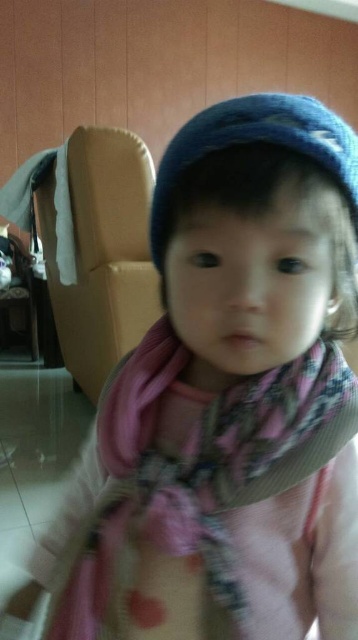
Question: Does pink plaid scarf at center have a lesser width compared to beige fabric armchair at left?

Choices:
 (A) yes
 (B) no

Answer: (A)

Question: Which is nearer to the beige fabric armchair at left?

Choices:
 (A) blue knitted hat at center
 (B) pink plaid scarf at center

Answer: (A)

Question: Does pink plaid scarf at center have a greater width compared to blue knitted hat at center?

Choices:
 (A) yes
 (B) no

Answer: (A)

Question: Among these objects, which one is nearest to the camera?

Choices:
 (A) blue knitted hat at center
 (B) pink plaid scarf at center

Answer: (A)

Question: Is pink plaid scarf at center above blue knitted hat at center?

Choices:
 (A) no
 (B) yes

Answer: (A)

Question: Which object appears closest to the camera in this image?

Choices:
 (A) beige fabric armchair at left
 (B) pink plaid scarf at center

Answer: (B)